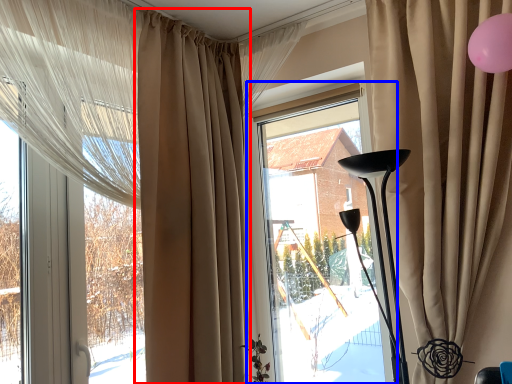
Question: Which point is closer to the camera, curtain (highlighted by a red box) or window (highlighted by a blue box)?

Choices:
 (A) curtain
 (B) window

Answer: (A)